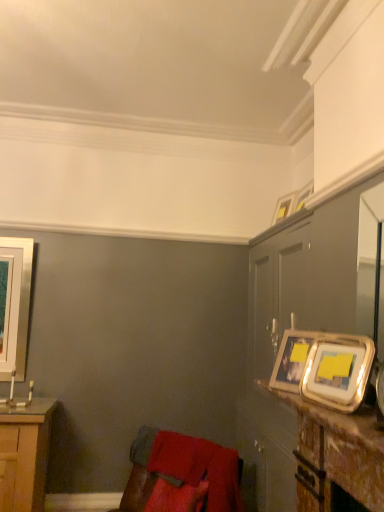
Locate an element on the screen. This screenshot has height=512, width=384. vacant space underneath silver metallic picture frame at right, which appears as the second picture frame when viewed from the right (from a real-world perspective) is located at coordinates (336, 410).